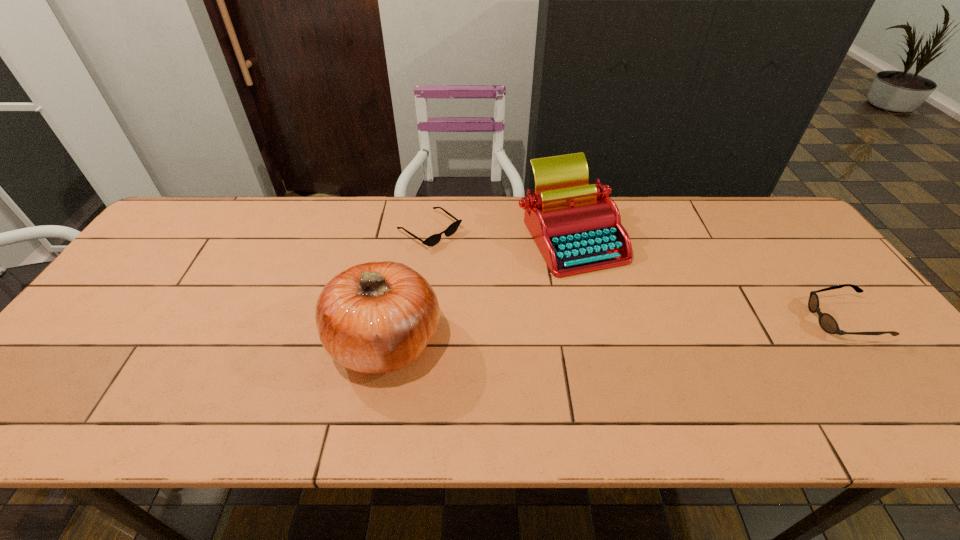
Identify the location of free space on the desktop that is between the tallest object and the rightmost object and is positioned on the typing side of the third shortest object. Image resolution: width=960 pixels, height=540 pixels. (554, 332).

Find the location of a particular element. This screenshot has height=540, width=960. vacant spot on the desktop that is between the pumpkin and the right sunglasses and is positioned on the front-facing side of the shorter sunglasses is located at coordinates (576, 331).